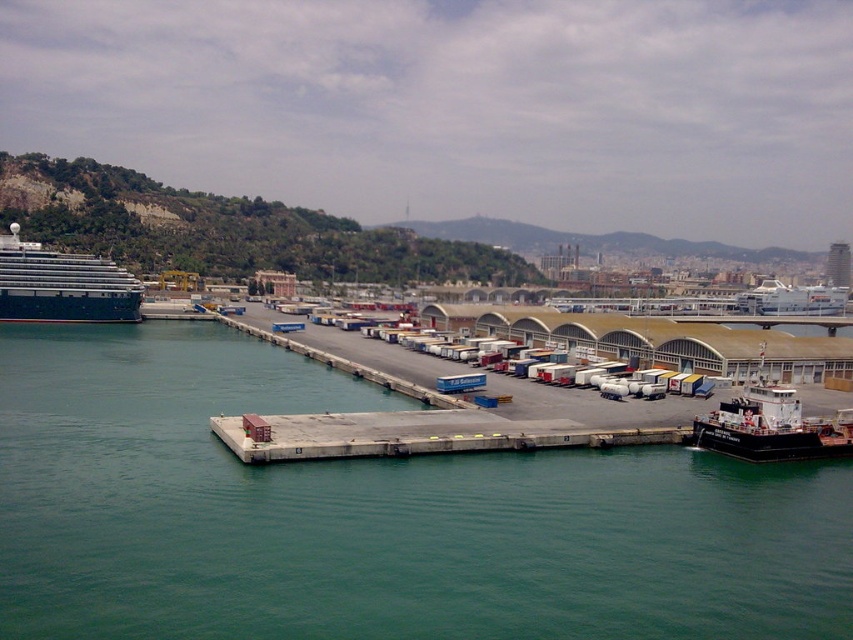
You are a port authority official assessing vessel heights for a new bridge under construction. The bridge will have a height restriction of 50 meters. You observe the shiny silver cruise ship at left and the black matte tugboat at lower right in the image. Can you determine if both vessels comply with the height restriction based on their relative sizes?

The shiny silver cruise ship at left is taller than the black matte tugboat at lower right. However, without specific height measurements, it is impossible to confirm if either vessel meets the 50 meter height restriction. Additional data on their actual heights is required for an accurate assessment.

You are standing at the center of the image and want to locate the green water at lower left. According to the coordinates provided, in which direction should you look to find it?

The green water at lower left is located at coordinates point (x=372, y=515), so you should look towards the lower left direction to find it.

You are a harbor pilot observing the shiny silver cruise ship at left and the black matte tugboat at lower right. Which vessel is positioned higher in the image?

The shiny silver cruise ship at left is located above the black matte tugboat at lower right in the image.